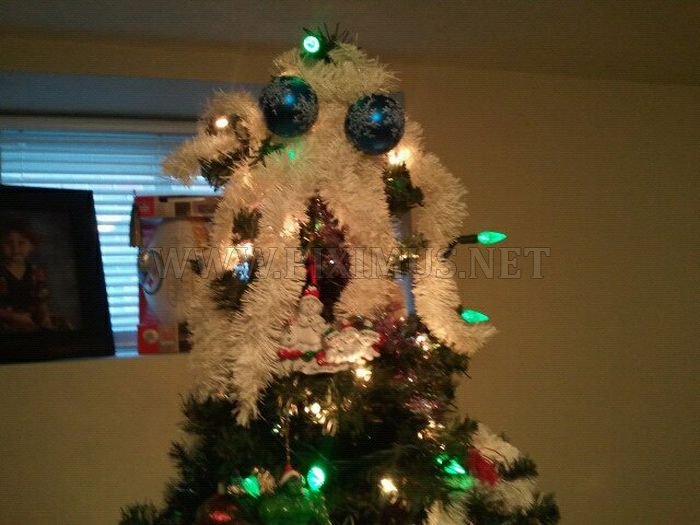
Find the location of a particular element. The height and width of the screenshot is (525, 700). window blind is located at coordinates (131, 169).